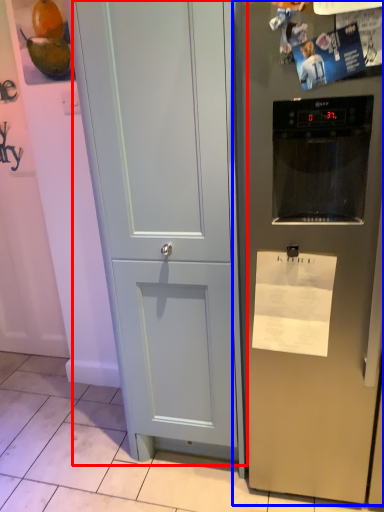
Question: Which of the following is the farthest to the observer, door (highlighted by a red box) or refrigerator (highlighted by a blue box)?

Choices:
 (A) door
 (B) refrigerator

Answer: (A)